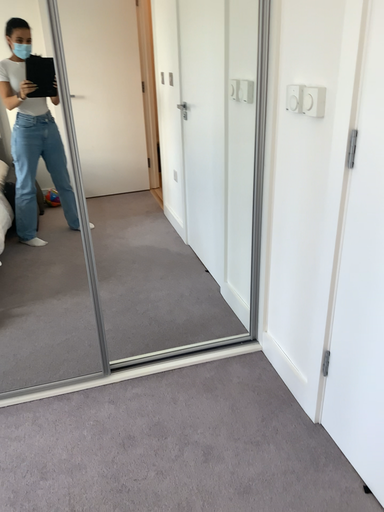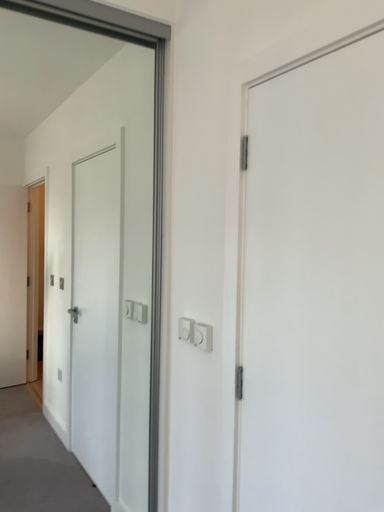
Question: Which way did the camera rotate in the video?

Choices:
 (A) rotated downward
 (B) rotated upward

Answer: (B)